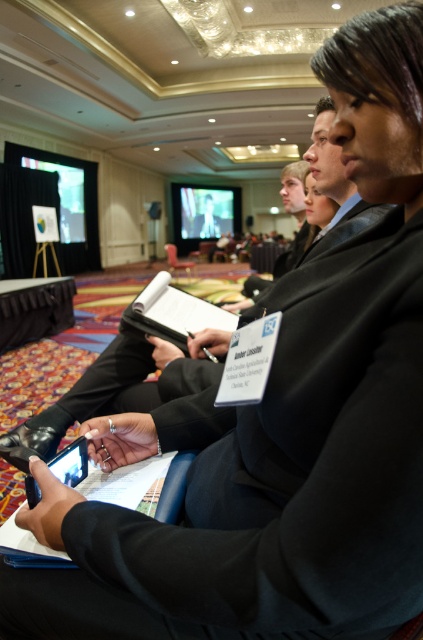
You are organizing a presentation and need to place a decorative plant between the black matte tablet computer at lower left and the wooden chair at center. Which object should the plant be closer to if it needs to be placed closer to the shorter one?

The black matte tablet computer at lower left is shorter than the wooden chair at center, so the plant should be placed closer to the black matte tablet computer at lower left.